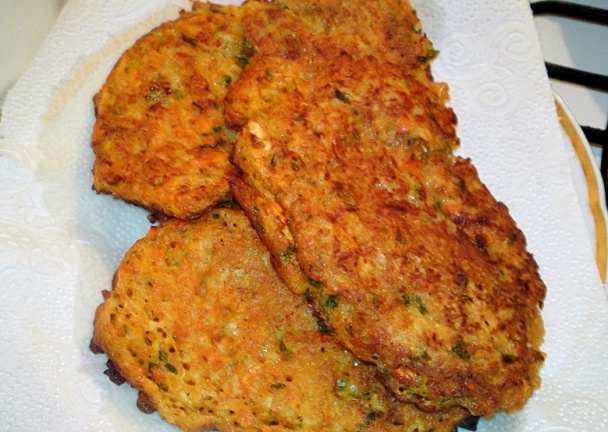
This screenshot has height=432, width=608. Find the location of `white paper towel`. white paper towel is located at coordinates (95, 18).